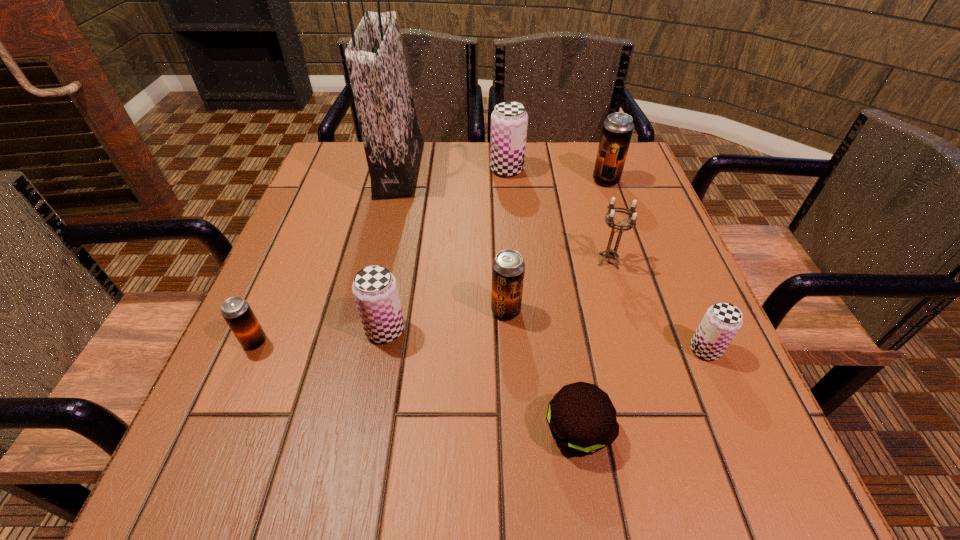
Image resolution: width=960 pixels, height=540 pixels. Find the location of `the second closest beer can to the leftmost object`. the second closest beer can to the leftmost object is located at coordinates (508, 267).

Where is `black beer can that is the second closest to the leftmost black beer can`? This screenshot has height=540, width=960. black beer can that is the second closest to the leftmost black beer can is located at coordinates (617, 130).

The height and width of the screenshot is (540, 960). What are the coordinates of `the second closest black beer can to the farthest black beer can` in the screenshot? It's located at (239, 316).

Select which purple beer can is the second closest to the patty. Please provide its 2D coordinates. Your answer should be formatted as a tuple, i.e. [(x, y)], where the tuple contains the x and y coordinates of a point satisfying the conditions above.

[(375, 290)]

Point out which purple beer can is positioned as the second nearest to the leftmost black beer can. Please provide its 2D coordinates. Your answer should be formatted as a tuple, i.e. [(x, y)], where the tuple contains the x and y coordinates of a point satisfying the conditions above.

[(509, 120)]

What are the coordinates of `blank area in the image that satisfies the following two spatial constraints: 1. on the back side of the fifth beer can from right to left; 2. on the front of the shopping bag with the design` in the screenshot? It's located at (415, 170).

In order to click on free space that satisfies the following two spatial constraints: 1. on the front of the tallest object with the design; 2. on the left side of the smallest purple beer can in this screenshot , I will do `click(357, 349)`.

In order to click on vacant point that satisfies the following two spatial constraints: 1. on the front side of the leftmost object; 2. on the right side of the rightmost purple beer can in this screenshot , I will do `click(252, 349)`.

Where is `vacant point that satisfies the following two spatial constraints: 1. on the front of the smallest purple beer can with the design; 2. on the right side of the tallest object`? vacant point that satisfies the following two spatial constraints: 1. on the front of the smallest purple beer can with the design; 2. on the right side of the tallest object is located at coordinates [x=357, y=349].